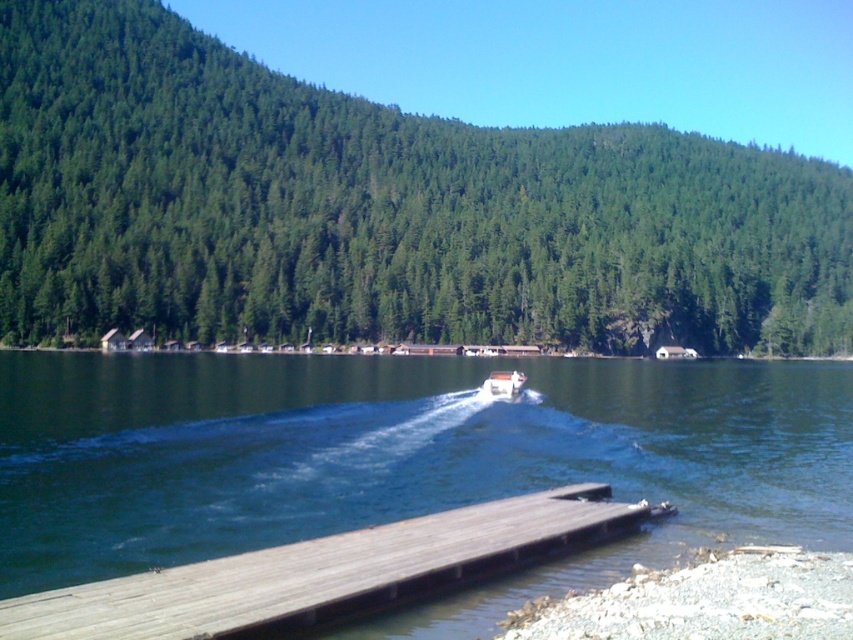
You are planning to set up a campsite. You have two options for locations based on the image. The first is near the green matte forest at upper center and the second is near the smooth gravel shore at lower right. Which location offers a wider area for setting up tents?

The green matte forest at upper center might be wider than smooth gravel shore at lower right, so it could provide a wider area for setting up tents.